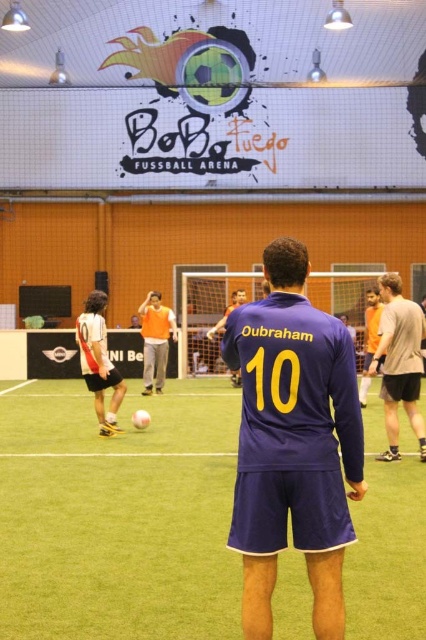
You are a photographer at the BoBo Fuego Fussball Arena. You need to capture a photo of both the purple matte jersey at center and orange jersey at center so that both are clearly visible. Given their height difference, which jersey should you position lower in the frame to ensure both are fully visible?

The purple matte jersey at center has a lesser height compared to orange jersey at center. To ensure both are fully visible, position the purple matte jersey at center lower in the frame so that the taller orange jersey at center does not block its view.

You are a soccer player positioned at point (213, 337) and want to pass the ball to your teammate at point (121, 516). Is the pass direction towards the front of your current position?

Yes, the pass direction towards point (121, 516) is in front of your current position at point (213, 337) because point (121, 516) is in front of point (213, 337).